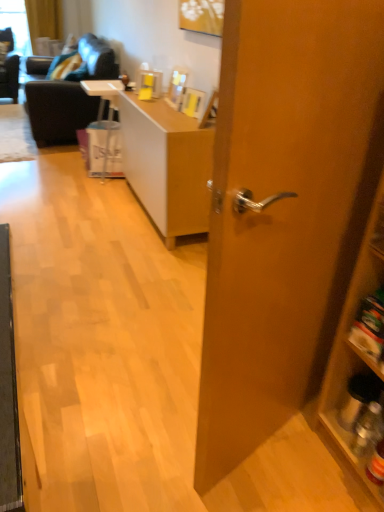
Find the location of a particular element. This screenshot has height=512, width=384. vacant area that is in front of light brown wood desk at center is located at coordinates click(x=129, y=267).